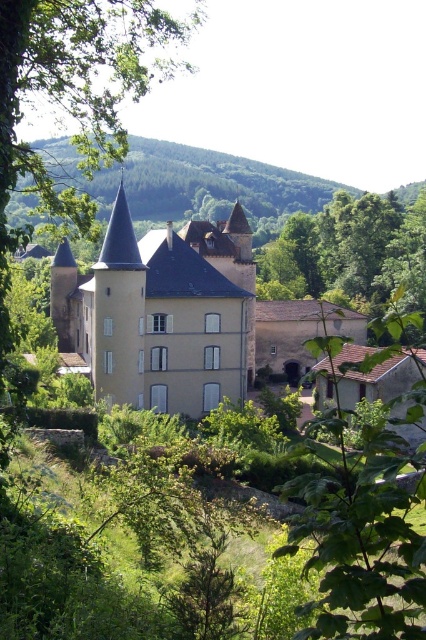
Question: Does beige stone castle at center appear over green leafy tree at center?

Choices:
 (A) yes
 (B) no

Answer: (B)

Question: Which object is closer to the camera taking this photo?

Choices:
 (A) green leafy tree at center
 (B) beige stone castle at center

Answer: (B)

Question: Can you confirm if beige stone castle at center is positioned to the left of green leafy tree at center?

Choices:
 (A) yes
 (B) no

Answer: (A)

Question: Among these points, which one is farthest from the camera?

Choices:
 (A) click(322, 237)
 (B) click(192, 339)

Answer: (A)

Question: Is beige stone castle at center above green leafy tree at center?

Choices:
 (A) yes
 (B) no

Answer: (B)